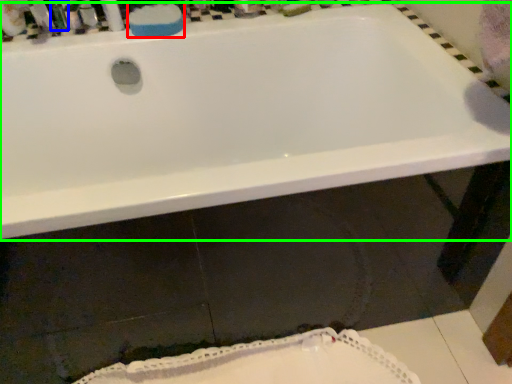
Question: Estimate the real-world distances between objects in this image. Which object is farther from soap (highlighted by a red box), toiletry (highlighted by a blue box) or bathtub (highlighted by a green box)?

Choices:
 (A) toiletry
 (B) bathtub

Answer: (B)